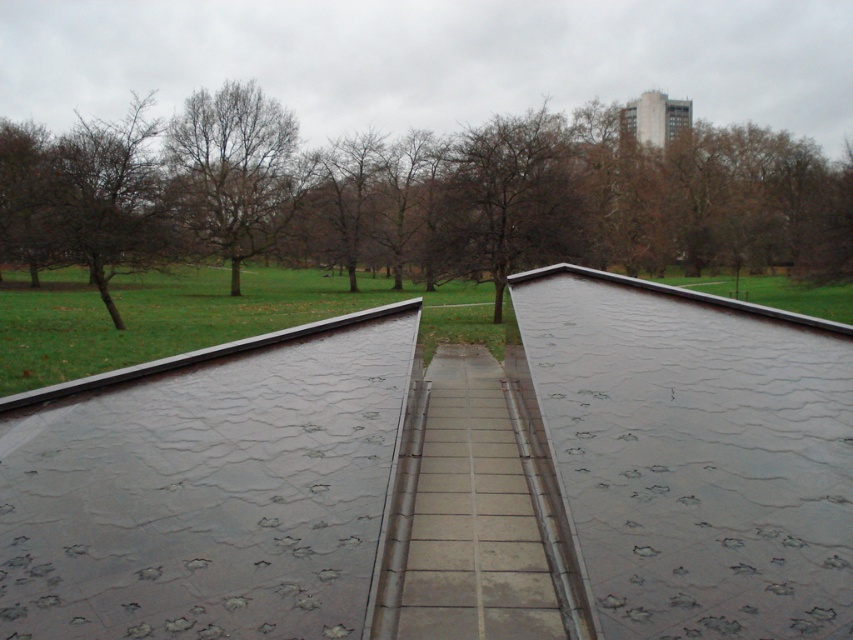
The height and width of the screenshot is (640, 853). What do you see at coordinates (207, 486) in the screenshot?
I see `glossy concrete ramp at center` at bounding box center [207, 486].

Can you confirm if glossy concrete ramp at center is wider than brown matte tree at center?

No.

The image size is (853, 640). Find the location of `glossy concrete ramp at center`. glossy concrete ramp at center is located at coordinates (207, 486).

Who is more forward, [614,172] or [448,168]?

Point [448,168]

Who is lower down, brown leafless tree at upper left or brown matte tree at center?

Positioned lower is brown leafless tree at upper left.

Find the location of a particular element. brown leafless tree at upper left is located at coordinates (425, 196).

Between brown leafless tree at upper left and glossy concrete ramp at center, which one has more height?

With more height is brown leafless tree at upper left.

I want to click on brown leafless tree at upper left, so click(x=425, y=196).

Who is more distant from viewer, (418, 224) or (343, 612)?

The point (418, 224) is behind.

Where is `brown leafless tree at upper left`? This screenshot has width=853, height=640. brown leafless tree at upper left is located at coordinates (425, 196).